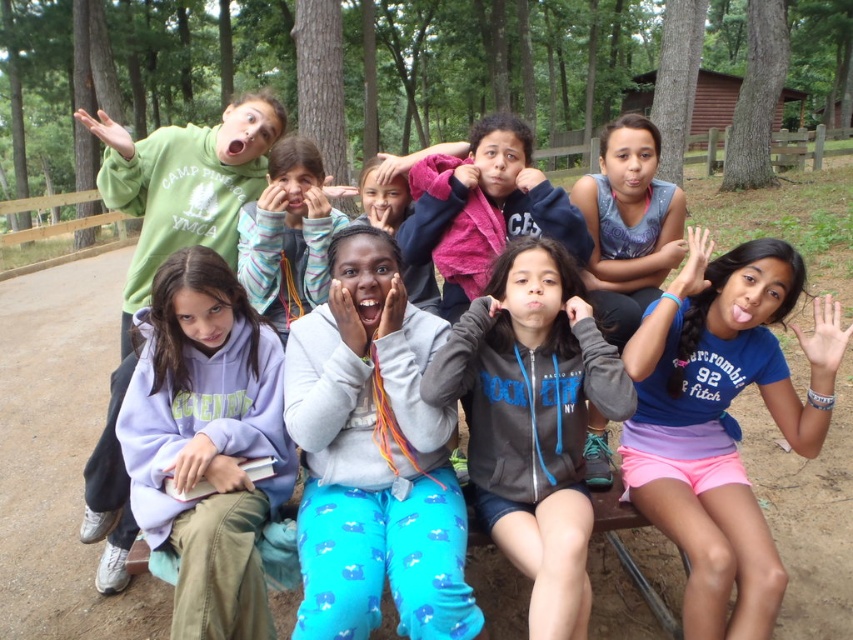
You are a photographer trying to capture a group photo of the children. You notice the blue cotton shirt at center and the purple fleece sweatshirt at left. Which child should you ask to move forward to ensure both are in focus?

The blue cotton shirt at center is taller than the purple fleece sweatshirt at left, so you should ask the child in the blue cotton shirt at center to move forward to ensure both are in focus.